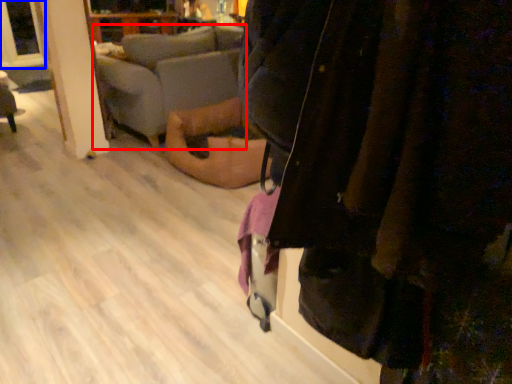
Question: Which object appears closest to the camera in this image, studio couch (highlighted by a red box) or window screen (highlighted by a blue box)?

Choices:
 (A) studio couch
 (B) window screen

Answer: (A)